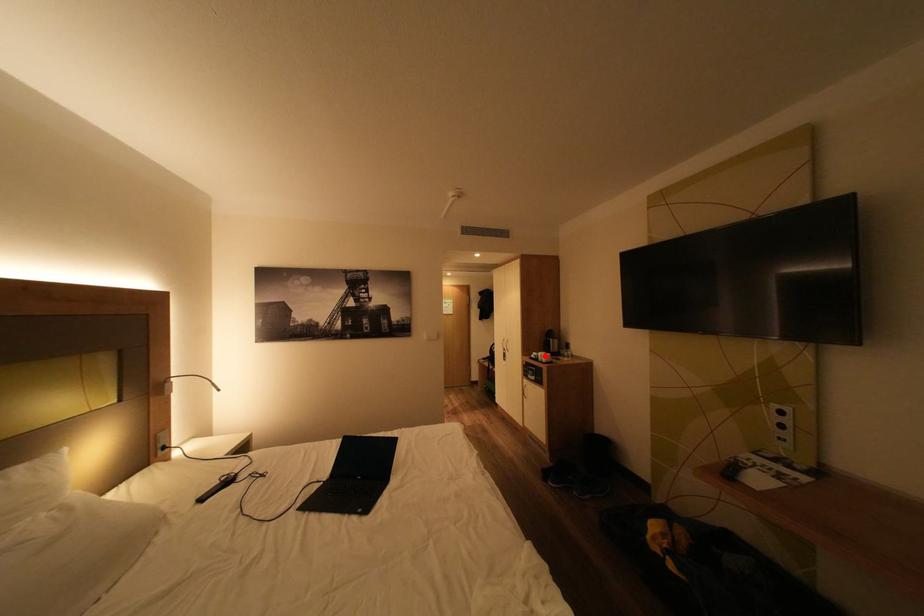
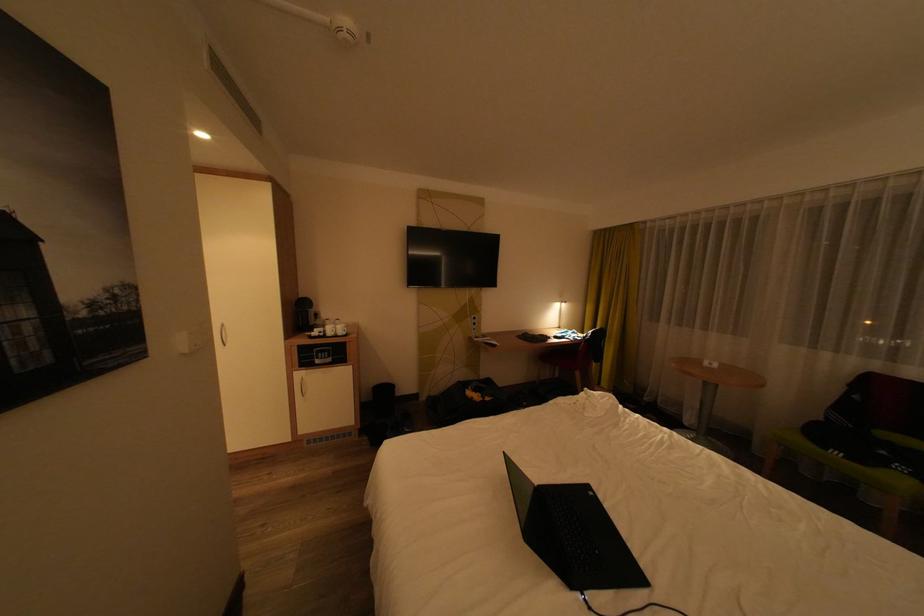
In the second image, find the point that corresponds to the highlighted location in the first image.

(331, 333)